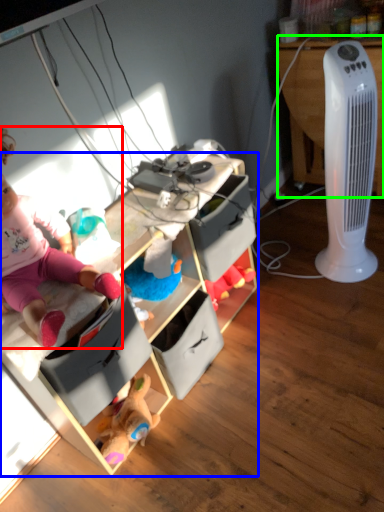
Question: Which object is positioned farthest from person (highlighted by a red box)? Select from cabinetry (highlighted by a blue box) and desk (highlighted by a green box).

Choices:
 (A) cabinetry
 (B) desk

Answer: (B)